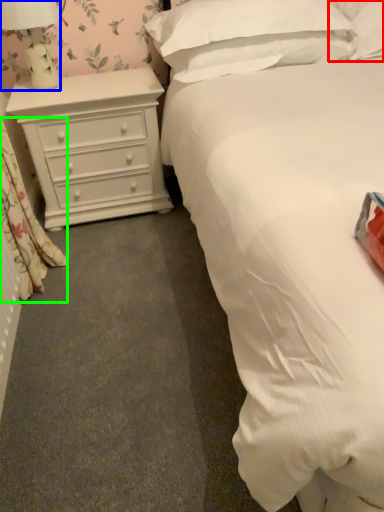
Question: Considering the real-world distances, which object is closest to pillow (highlighted by a red box)? lamp (highlighted by a blue box) or curtain (highlighted by a green box).

Choices:
 (A) lamp
 (B) curtain

Answer: (A)